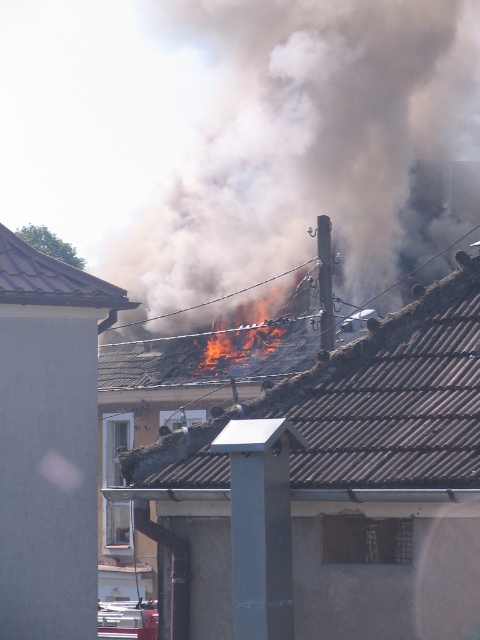
Question: Does smoke/dense at center appear over metallic tile roof at upper left?

Choices:
 (A) yes
 (B) no

Answer: (A)

Question: Which object appears closest to the camera in this image?

Choices:
 (A) smoke/dense at center
 (B) metallic tile roof at upper left
 (C) brown tile roof at center

Answer: (C)

Question: Considering the relative positions of brown tile roof at center and flaming wood at center in the image provided, where is brown tile roof at center located with respect to flaming wood at center?

Choices:
 (A) right
 (B) left

Answer: (A)

Question: Does smoke/dense at center appear on the left side of brown tile roof at center?

Choices:
 (A) yes
 (B) no

Answer: (B)

Question: Among these objects, which one is nearest to the camera?

Choices:
 (A) brown tile roof at center
 (B) flaming wood at center
 (C) smoke/dense at center

Answer: (A)

Question: Which of these objects is positioned farthest from the smoke/dense at center?

Choices:
 (A) brown tile roof at center
 (B) flaming wood at center

Answer: (A)